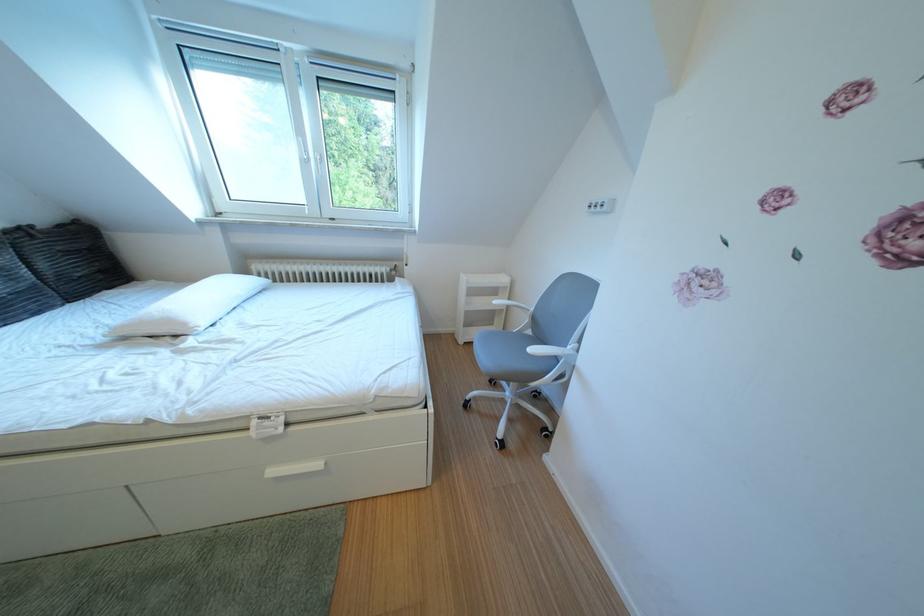
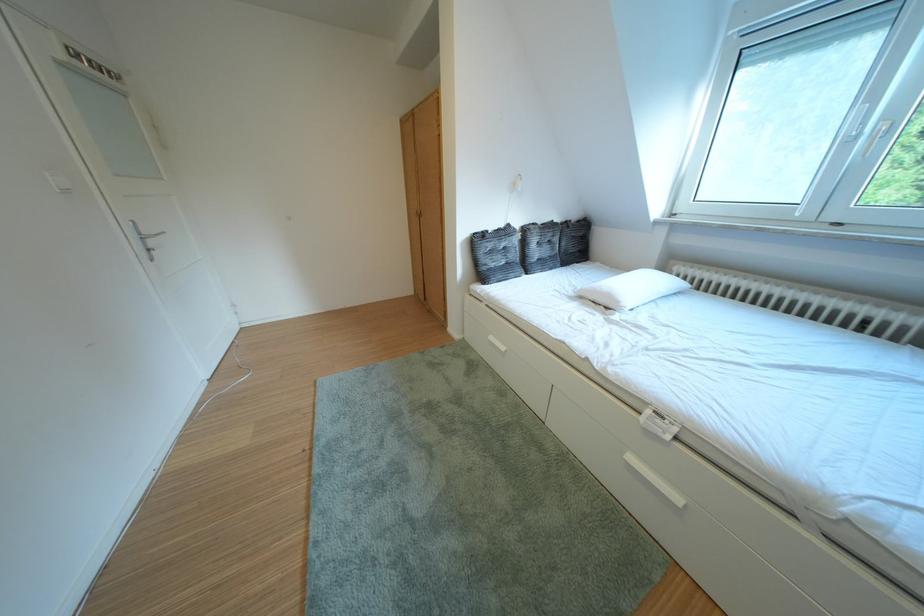
The point at (x=54, y=224) is marked in the first image. Where is the corresponding point in the second image?

(588, 222)